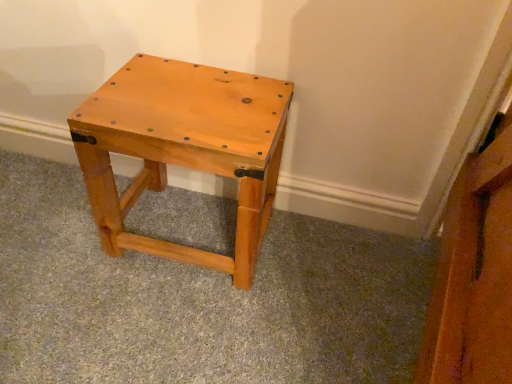
This screenshot has height=384, width=512. Identify the location of vacant area that lies to the right of natural wood stool at center. (327, 266).